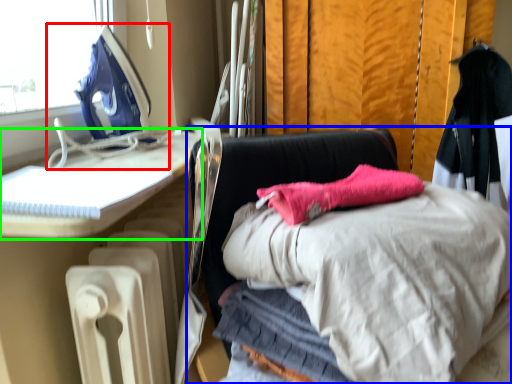
Question: Based on their relative distances, which object is nearer to sewing machine (highlighted by a red box)? Choose from furniture (highlighted by a blue box) and furniture (highlighted by a green box).

Choices:
 (A) furniture
 (B) furniture

Answer: (B)